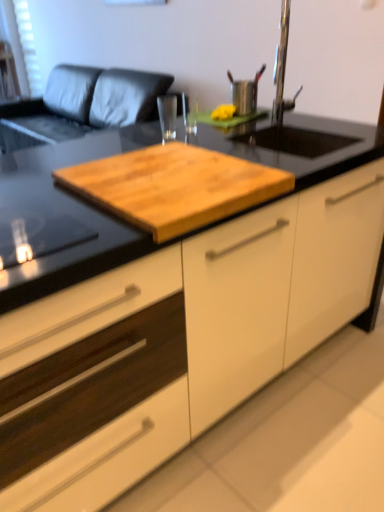
Question: Would you say white matte cabinet at center is to the left or to the right of metallic stainless steel cup at upper center in the picture?

Choices:
 (A) left
 (B) right

Answer: (A)

Question: Does point (210, 334) appear closer or farther from the camera than point (246, 84)?

Choices:
 (A) closer
 (B) farther

Answer: (A)

Question: Which of these objects is positioned closest to the natural wood cutting board at center?

Choices:
 (A) white mesh screen at upper left
 (B) metallic stainless steel cup at upper center
 (C) white matte cabinet at center
 (D) leather couch at upper left

Answer: (C)

Question: Which object is the closest to the leather couch at upper left?

Choices:
 (A) natural wood cutting board at center
 (B) metallic stainless steel cup at upper center
 (C) white matte cabinet at center
 (D) white mesh screen at upper left

Answer: (D)